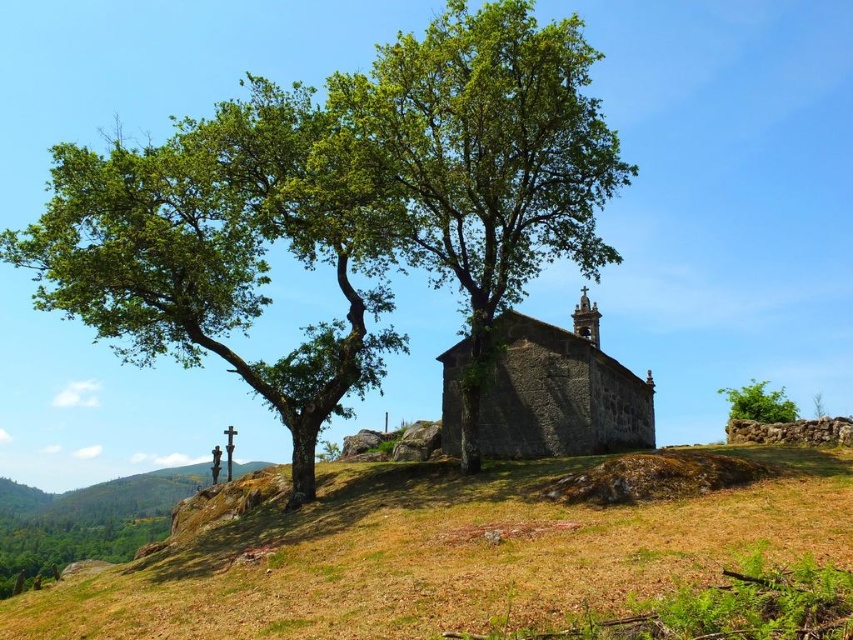
Question: Is dry grass at center to the left of stone church at center from the viewer's perspective?

Choices:
 (A) yes
 (B) no

Answer: (A)

Question: Is green leafy tree at left thinner than green leafy tree at center?

Choices:
 (A) no
 (B) yes

Answer: (A)

Question: Estimate the real-world distances between objects in this image. Which object is closer to the green leafy tree at center?

Choices:
 (A) stone church at center
 (B) dry grass at center
 (C) green leafy bush at upper right

Answer: (A)

Question: Is green leafy tree at left above green leafy tree at center?

Choices:
 (A) no
 (B) yes

Answer: (A)

Question: Which point appears farthest from the camera in this image?

Choices:
 (A) (376, 221)
 (B) (701, 573)
 (C) (300, 460)

Answer: (A)

Question: Which is nearer to the stone church at center?

Choices:
 (A) green leafy bush at upper right
 (B) dry grass at center

Answer: (B)